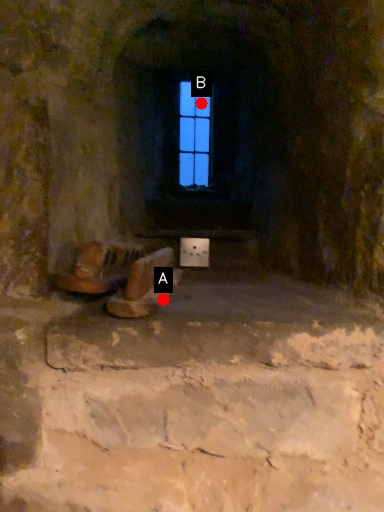
Question: Two points are circled on the image, labeled by A and B beside each circle. Which point appears closest to the camera in this image?

Choices:
 (A) A is closer
 (B) B is closer

Answer: (A)